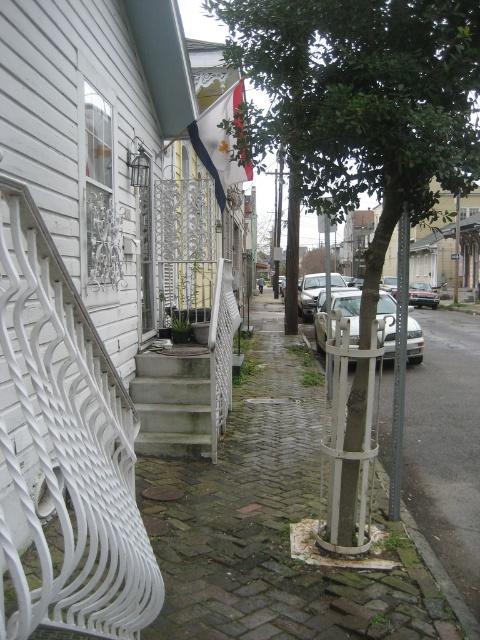
Question: Is white fabric flag at upper center below metallic gray pole at right?

Choices:
 (A) yes
 (B) no

Answer: (B)

Question: Which of the following is the closest to the observer?

Choices:
 (A) (319, 266)
 (B) (100, 564)
 (C) (238, 51)

Answer: (B)

Question: Which of the following is the closest to the observer?

Choices:
 (A) green textured tree at center
 (B) green mossy concrete stairs at center
 (C) satin silver car at center
 (D) metallic gray pole at right

Answer: (A)

Question: Does white fabric flag at upper center have a smaller size compared to green leafy tree at center?

Choices:
 (A) no
 (B) yes

Answer: (B)

Question: Which point is farther to the camera?

Choices:
 (A) white wrought iron bench at left
 (B) silver metallic car at center
 (C) green textured tree at center
 (D) green mossy concrete stairs at center

Answer: (D)

Question: Is white wrought iron bench at left above white fabric flag at upper center?

Choices:
 (A) no
 (B) yes

Answer: (A)